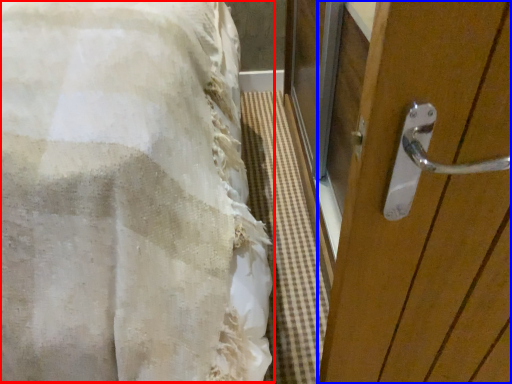
Question: Which point is further to the camera, bed (highlighted by a red box) or door (highlighted by a blue box)?

Choices:
 (A) bed
 (B) door

Answer: (B)